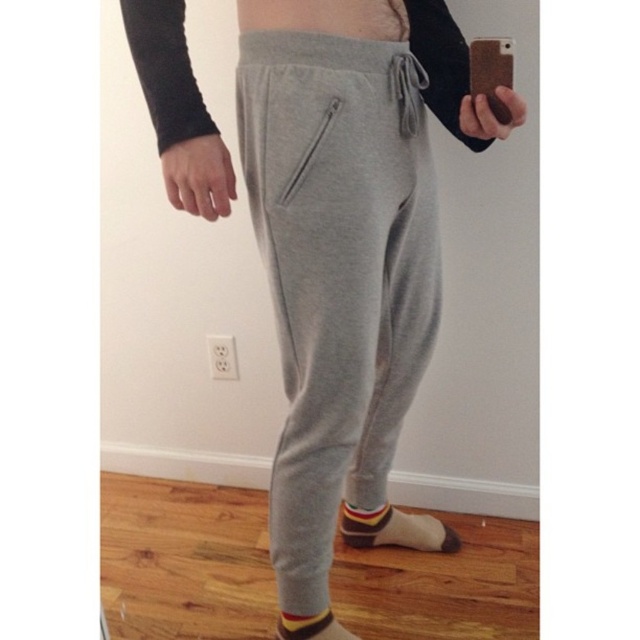
Question: Does heather gray sweatpants at center have a greater width compared to gray fabric pocket at center?

Choices:
 (A) yes
 (B) no

Answer: (A)

Question: Is gray fleece sweatpants at center to the right of striped cotton sock at lower center from the viewer's perspective?

Choices:
 (A) no
 (B) yes

Answer: (A)

Question: Does heather gray sweatpants at center have a smaller size compared to multicolored knit sock at lower center?

Choices:
 (A) yes
 (B) no

Answer: (B)

Question: Estimate the real-world distances between objects in this image. Which object is closer to the heather gray sweatpants at center?

Choices:
 (A) hair at center
 (B) gray fleece sweatpants at center
 (C) gray fabric pocket at center

Answer: (B)

Question: Which point is closer to the camera?

Choices:
 (A) multicolored knit sock at lower center
 (B) striped cotton sock at lower center
 (C) hair at center
 (D) heather gray sweatpants at center

Answer: (D)

Question: Which point is closer to the camera?

Choices:
 (A) (296, 140)
 (B) (400, 74)
 (C) (362, 264)

Answer: (A)